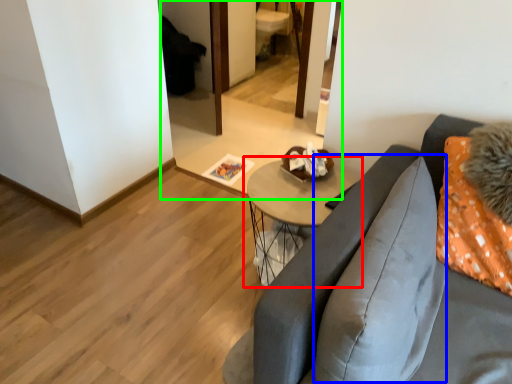
Question: Which is farther away from table (highlighted by a red box)? pillow (highlighted by a blue box) or mirror (highlighted by a green box)?

Choices:
 (A) pillow
 (B) mirror

Answer: (B)